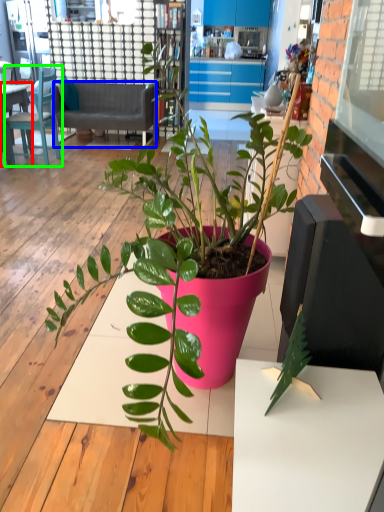
Question: Which is nearer to the desk (highlighted by a red box)? studio couch (highlighted by a blue box) or chair (highlighted by a green box).

Choices:
 (A) studio couch
 (B) chair

Answer: (B)